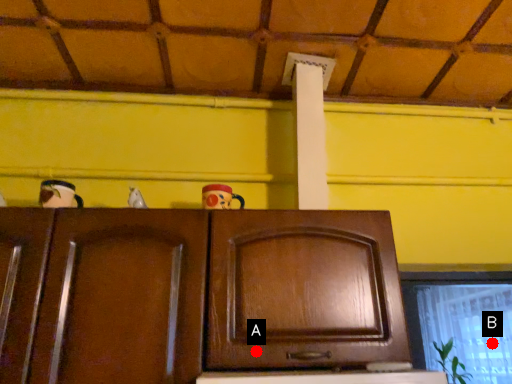
Question: Two points are circled on the image, labeled by A and B beside each circle. Among these points, which one is farthest from the camera?

Choices:
 (A) A is further
 (B) B is further

Answer: (B)